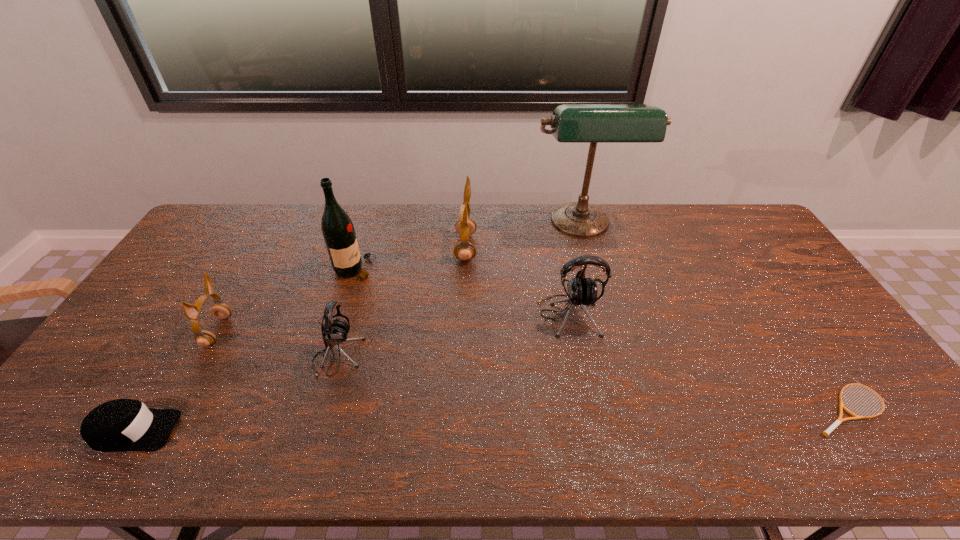
The height and width of the screenshot is (540, 960). I want to click on free region located 0.250m on the front-facing side of the nearer brown earphone, so click(315, 331).

The width and height of the screenshot is (960, 540). Identify the location of free space located 0.200m on the left of the left black earphone. (240, 357).

You are a GUI agent. You are given a task and a screenshot of the screen. Output one action in this format:
    pyautogui.click(x=<x>, y=<y>)
    Task: Click on the free location located 0.080m on the front-facing side of the cap
    
    Given the screenshot: What is the action you would take?
    pyautogui.click(x=209, y=431)

The image size is (960, 540). I want to click on vacant point located 0.170m on the back of the beige tennis racket, so click(796, 330).

Identify the location of table lamp present at the far edge. This screenshot has width=960, height=540. (571, 123).

Find the location of a particular element. The height and width of the screenshot is (540, 960). earphone that is at the far edge is located at coordinates (465, 227).

You are a GUI agent. You are given a task and a screenshot of the screen. Output one action in this format:
    pyautogui.click(x=<x>, y=<y>)
    Task: Click on the cap located in the near edge section of the desktop
    The height and width of the screenshot is (540, 960).
    Given the screenshot: What is the action you would take?
    pyautogui.click(x=119, y=425)

Find the location of a particular element. This screenshot has height=540, width=960. tennis racket positioned at the near edge is located at coordinates (826, 433).

The width and height of the screenshot is (960, 540). I want to click on object positioned at the left edge, so click(x=119, y=425).

Locate an element on the screen. Image resolution: width=960 pixels, height=540 pixels. object present at the right edge is located at coordinates (826, 433).